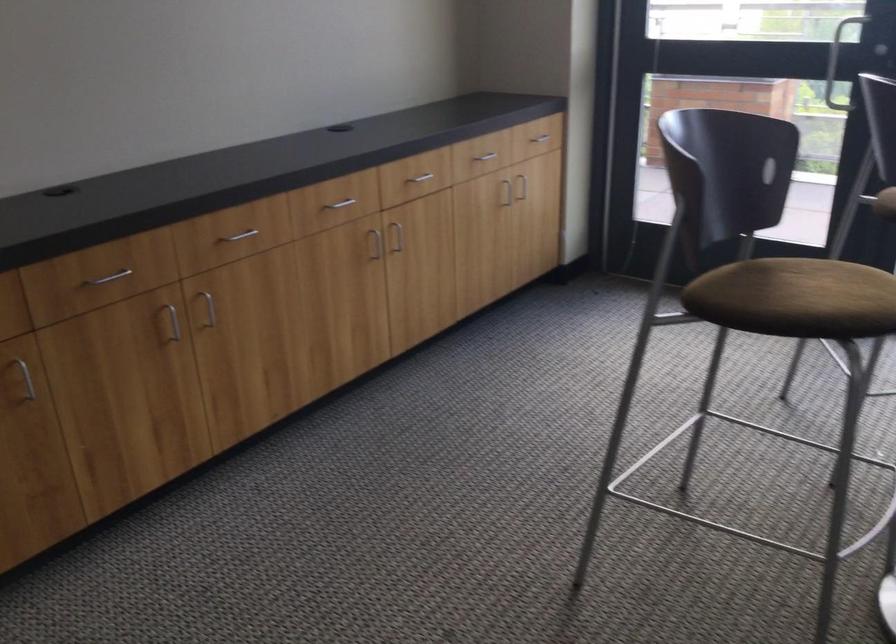
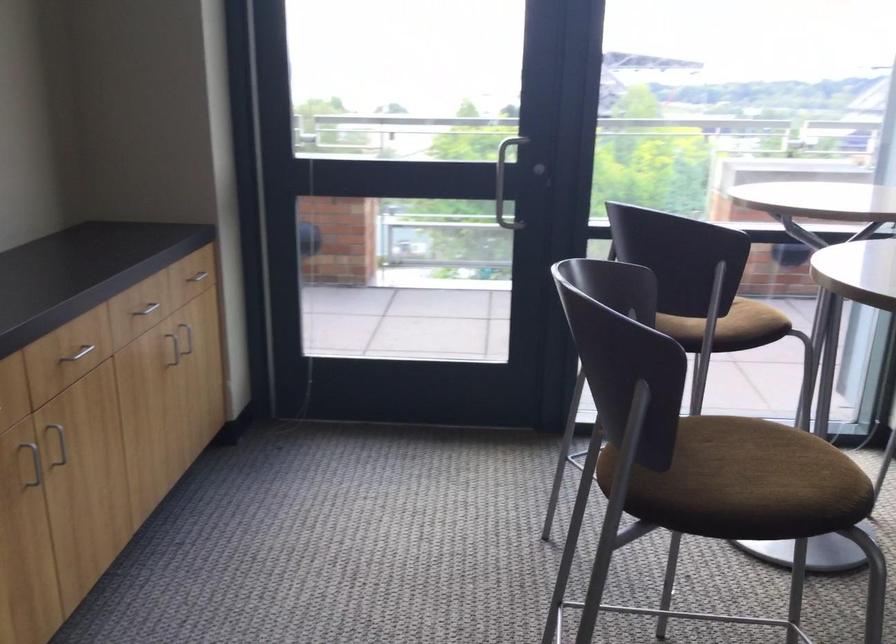
Find the pixel in the second image that matches point (392, 232) in the first image.

(57, 442)